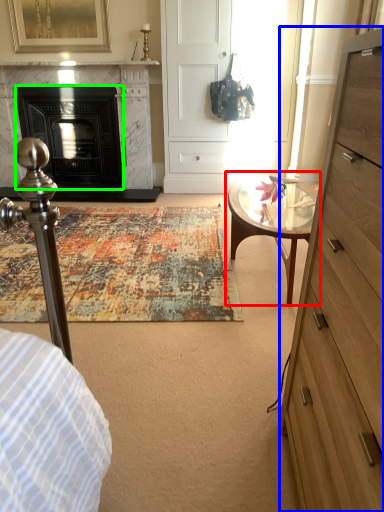
Question: Based on their relative distances, which object is nearer to coffee table (highlighted by a red box)? Choose from chest of drawers (highlighted by a blue box) and fireplace (highlighted by a green box).

Choices:
 (A) chest of drawers
 (B) fireplace

Answer: (A)